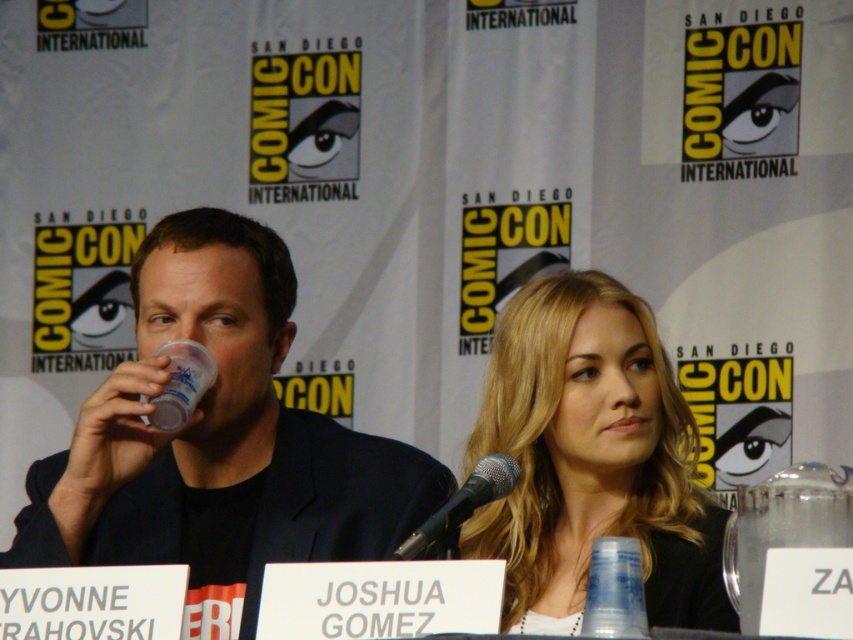
You are a photographer at the panel discussion and need to focus on the two points in the image. Which point, point [685,422] or point [181,416], is closer to your camera lens?

Point [685,422] is further to the camera than point [181,416], so the closer point to the camera lens is point [181,416].

You are a photographer at the event and want to capture a photo that includes both the black matte suit at center and the translucent plastic cup at upper left. Since you need to ensure both are in focus, which object should you focus on first to account for their size difference?

The black matte suit at center is taller than the translucent plastic cup at upper left, so you should focus on the black matte suit at center first as it is larger and requires more precise focus to ensure clarity.

You are attending a panel at San Diego Comic Con and see the black matte suit at center and the translucent plastic cup at upper left. Which object is closer to the front of the stage?

The translucent plastic cup at upper left is closer to the front of the stage because the black matte suit at center is positioned under it, indicating it is behind.